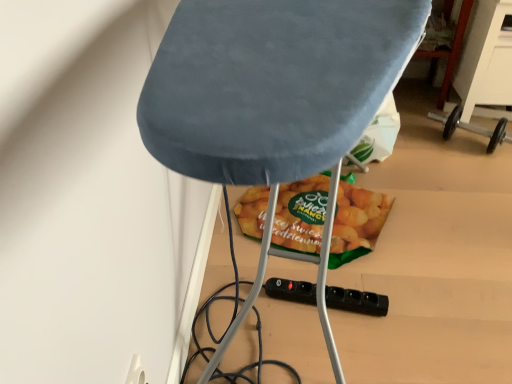
Question: From a real-world perspective, is black plastic socket at lower center above or below green matte snack at center?

Choices:
 (A) below
 (B) above

Answer: (B)

Question: From the image's perspective, is black plastic socket at lower center located above or below green matte snack at center?

Choices:
 (A) above
 (B) below

Answer: (B)

Question: Which object is the closest to the black plastic socket at lower center?

Choices:
 (A) velvet blue ironing board at center
 (B) green matte snack at center

Answer: (B)

Question: Estimate the real-world distances between objects in this image. Which object is closer to the black plastic socket at lower center?

Choices:
 (A) velvet blue ironing board at center
 (B) green matte snack at center

Answer: (B)